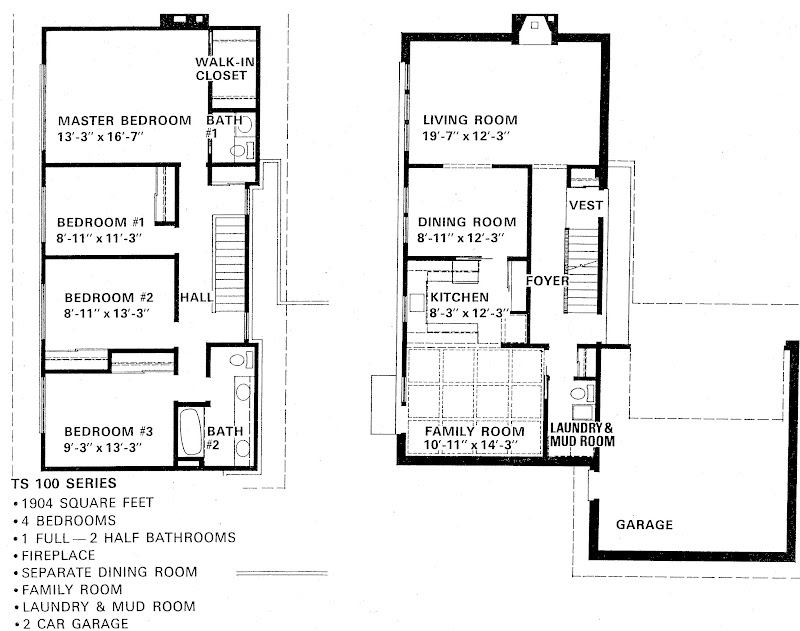
Identify the location of closets. (82, 360), (146, 366), (176, 198), (236, 174), (236, 85), (584, 363), (508, 332).